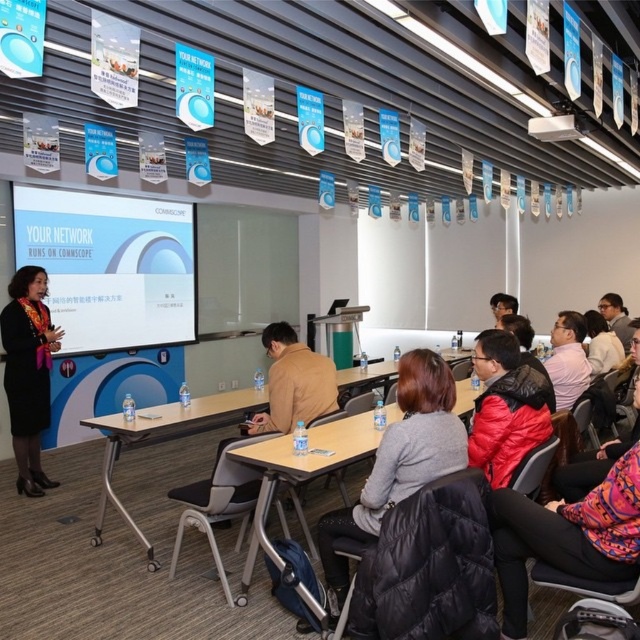
You are an attendee at the event and want to take a photo of the presenter. The black fabric dress at lower left is blocking your view of the pink fabric shirt at center. Can you move around to the right side to get a clear shot?

The pink fabric shirt at center is behind the black fabric dress at lower left, so moving to the right side might allow you to see around the dress and capture the presenter in the pink fabric shirt at center.